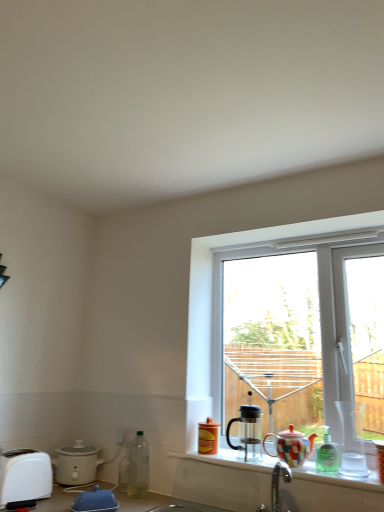
Question: Is white plastic electric outlet at lower left not within transparent plastic window at center?

Choices:
 (A) yes
 (B) no

Answer: (A)

Question: From a real-world perspective, is white plastic electric outlet at lower left over transparent plastic window at center?

Choices:
 (A) yes
 (B) no

Answer: (B)

Question: From a real-world perspective, is white plastic electric outlet at lower left positioned under transparent plastic window at center based on gravity?

Choices:
 (A) yes
 (B) no

Answer: (A)

Question: From the image's perspective, would you say white plastic electric outlet at lower left is shown under transparent plastic window at center?

Choices:
 (A) yes
 (B) no

Answer: (A)

Question: Is white plastic electric outlet at lower left shorter than transparent plastic window at center?

Choices:
 (A) yes
 (B) no

Answer: (A)

Question: Looking at the image, does white plastic toaster at lower left seem bigger or smaller compared to blue rubber duck at lower left?

Choices:
 (A) small
 (B) big

Answer: (B)

Question: Considering the positions of white plastic toaster at lower left and blue rubber duck at lower left in the image, is white plastic toaster at lower left wider or thinner than blue rubber duck at lower left?

Choices:
 (A) wide
 (B) thin

Answer: (A)

Question: From their relative heights in the image, would you say white plastic toaster at lower left is taller or shorter than blue rubber duck at lower left?

Choices:
 (A) short
 (B) tall

Answer: (B)

Question: Considering the positions of point (39, 464) and point (94, 497), is point (39, 464) closer or farther from the camera than point (94, 497)?

Choices:
 (A) closer
 (B) farther

Answer: (B)

Question: In terms of size, does white plastic toaster at lower left appear bigger or smaller than multicolored ceramic coffee cup at right, which is the first coffee cup in right-to-left order?

Choices:
 (A) small
 (B) big

Answer: (B)

Question: Is white plastic toaster at lower left taller or shorter than multicolored ceramic coffee cup at right, which is the first coffee cup in right-to-left order?

Choices:
 (A) tall
 (B) short

Answer: (A)

Question: From the image's perspective, relative to multicolored ceramic coffee cup at right, the 3th coffee cup positioned from the left, is white plastic toaster at lower left above or below?

Choices:
 (A) above
 (B) below

Answer: (B)

Question: Relative to multicolored ceramic coffee cup at right, the 3th coffee cup positioned from the left, is white plastic toaster at lower left in front or behind?

Choices:
 (A) behind
 (B) front

Answer: (A)

Question: Is point (379, 465) closer or farther from the camera than point (332, 464)?

Choices:
 (A) farther
 (B) closer

Answer: (B)

Question: Is multicolored ceramic coffee cup at right, the 3th coffee cup positioned from the left, bigger or smaller than green translucent bottle at lower right, the third bottle viewed from the left?

Choices:
 (A) small
 (B) big

Answer: (B)